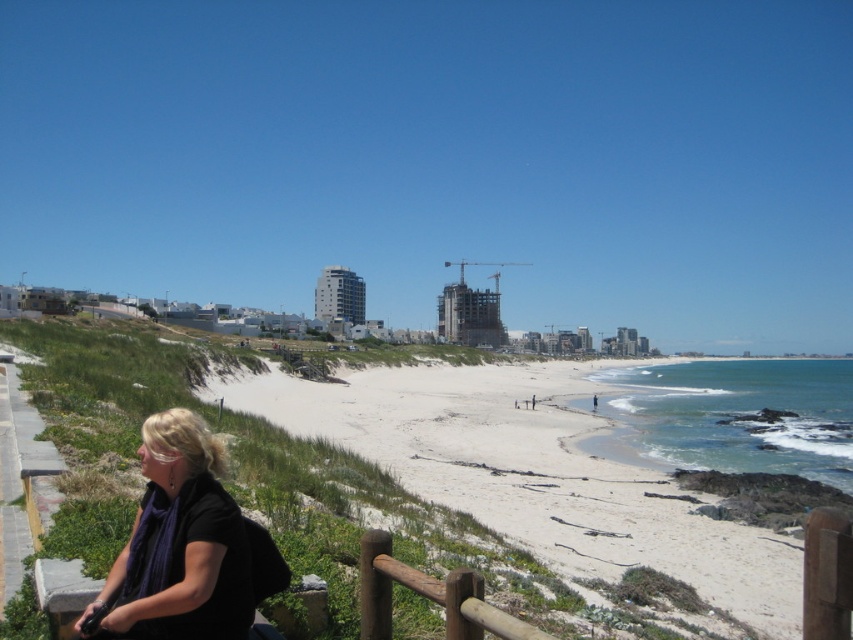
Which is more to the right, black matte scarf at lower left or brown wooden rail at lower center?

Positioned to the right is brown wooden rail at lower center.

Can you confirm if black matte scarf at lower left is shorter than brown wooden rail at lower center?

In fact, black matte scarf at lower left may be taller than brown wooden rail at lower center.

Describe the element at coordinates (178, 545) in the screenshot. I see `black matte scarf at lower left` at that location.

Identify the location of black matte scarf at lower left. The height and width of the screenshot is (640, 853). (178, 545).